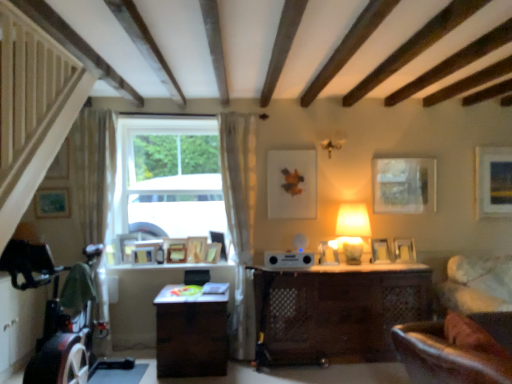
Question: From the image's perspective, is matte silver picture frame at right, positioned as the fourth picture frame in right-to-left order, below wooden picture frame at center, the eighth picture frame when ordered from left to right?

Choices:
 (A) yes
 (B) no

Answer: (A)

Question: Does matte silver picture frame at right, positioned as the fourth picture frame in right-to-left order, have a greater width compared to wooden picture frame at center, the eighth picture frame when ordered from left to right?

Choices:
 (A) yes
 (B) no

Answer: (A)

Question: Is matte silver picture frame at right, positioned as the fourth picture frame in right-to-left order, next to wooden picture frame at center, the eighth picture frame when ordered from left to right, and touching it?

Choices:
 (A) no
 (B) yes

Answer: (A)

Question: Is matte silver picture frame at right, positioned as the fourth picture frame in right-to-left order, located outside wooden picture frame at center, the eighth picture frame when ordered from left to right?

Choices:
 (A) yes
 (B) no

Answer: (A)

Question: Can you confirm if matte silver picture frame at right, placed as the tenth picture frame when sorted from left to right, is shorter than wooden picture frame at center, the eighth picture frame when ordered from left to right?

Choices:
 (A) no
 (B) yes

Answer: (B)

Question: From a real-world perspective, is white plastic speaker at center above or below matte silver picture frame at right, positioned as the fourth picture frame in right-to-left order?

Choices:
 (A) below
 (B) above

Answer: (A)

Question: Would you say white plastic speaker at center is inside or outside matte silver picture frame at right, positioned as the fourth picture frame in right-to-left order?

Choices:
 (A) inside
 (B) outside

Answer: (B)

Question: From the image's perspective, relative to matte silver picture frame at right, positioned as the fourth picture frame in right-to-left order, is white plastic speaker at center above or below?

Choices:
 (A) below
 (B) above

Answer: (A)

Question: In terms of size, does white plastic speaker at center appear bigger or smaller than matte silver picture frame at right, positioned as the fourth picture frame in right-to-left order?

Choices:
 (A) big
 (B) small

Answer: (A)

Question: In terms of height, does velvet green swivel chair at lower right look taller or shorter compared to wooden picture frame at center, the 9th picture frame from the right?

Choices:
 (A) tall
 (B) short

Answer: (A)

Question: From the image's perspective, is velvet green swivel chair at lower right positioned above or below wooden picture frame at center, the 9th picture frame from the right?

Choices:
 (A) below
 (B) above

Answer: (A)

Question: Considering the relative positions of velvet green swivel chair at lower right and wooden picture frame at center, which is counted as the 5th picture frame, starting from the left, in the image provided, is velvet green swivel chair at lower right to the left or to the right of wooden picture frame at center, which is counted as the 5th picture frame, starting from the left,?

Choices:
 (A) right
 (B) left

Answer: (A)

Question: Based on their sizes in the image, would you say velvet green swivel chair at lower right is bigger or smaller than wooden picture frame at center, the 9th picture frame from the right?

Choices:
 (A) small
 (B) big

Answer: (B)

Question: Looking at their shapes, would you say matte gold picture frame at upper right, the thirteenth picture frame in the left-to-right sequence, is wider or thinner than wooden picture frame at center, which is the 6th picture frame from left to right?

Choices:
 (A) wide
 (B) thin

Answer: (B)

Question: Would you say matte gold picture frame at upper right, the thirteenth picture frame in the left-to-right sequence, is inside or outside wooden picture frame at center, which is the 6th picture frame from left to right?

Choices:
 (A) outside
 (B) inside

Answer: (A)